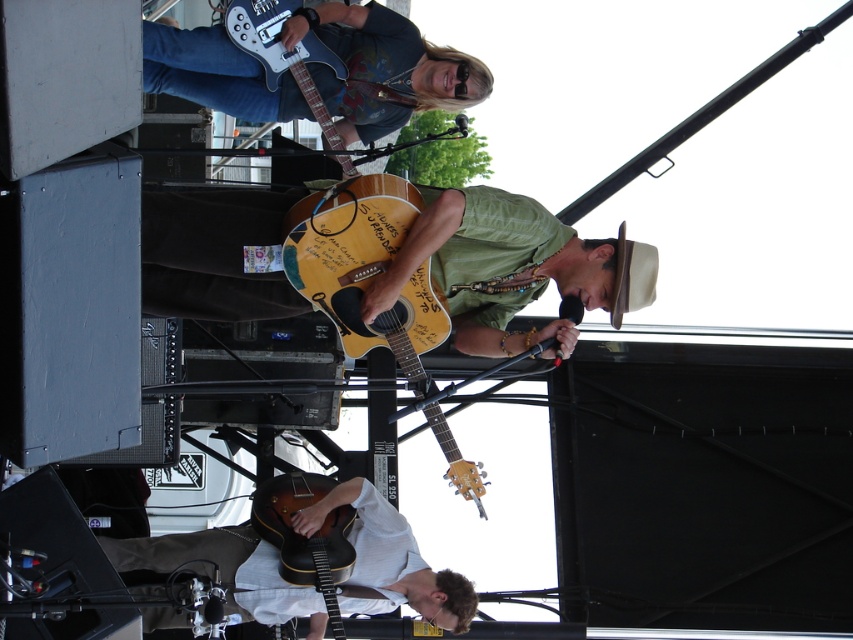
Is point (277, 316) positioned before point (242, 36)?

That is True.

Does matte yellow acoustic guitar at center have a larger size compared to metallic silver electric guitar at upper center?

Yes, matte yellow acoustic guitar at center is bigger than metallic silver electric guitar at upper center.

Does point (148, 280) lie behind point (252, 45)?

No, (148, 280) is closer to viewer.

The width and height of the screenshot is (853, 640). I want to click on matte yellow acoustic guitar at center, so click(508, 268).

In the scene shown: Who is taller, wooden acoustic guitar at lower center or yellow wood guitar at center?

wooden acoustic guitar at lower center is taller.

Image resolution: width=853 pixels, height=640 pixels. Identify the location of wooden acoustic guitar at lower center. (390, 561).

Is point (207, 552) behind point (357, 323)?

Yes, it is.

At what (x,y) coordinates should I click in order to perform the action: click on wooden acoustic guitar at lower center. Please return your answer as a coordinate pair (x, y). The width and height of the screenshot is (853, 640). Looking at the image, I should click on (390, 561).

Can you confirm if matte yellow acoustic guitar at center is thinner than wooden acoustic guitar at lower center?

No, matte yellow acoustic guitar at center is not thinner than wooden acoustic guitar at lower center.

In order to click on matte yellow acoustic guitar at center in this screenshot , I will do `click(508, 268)`.